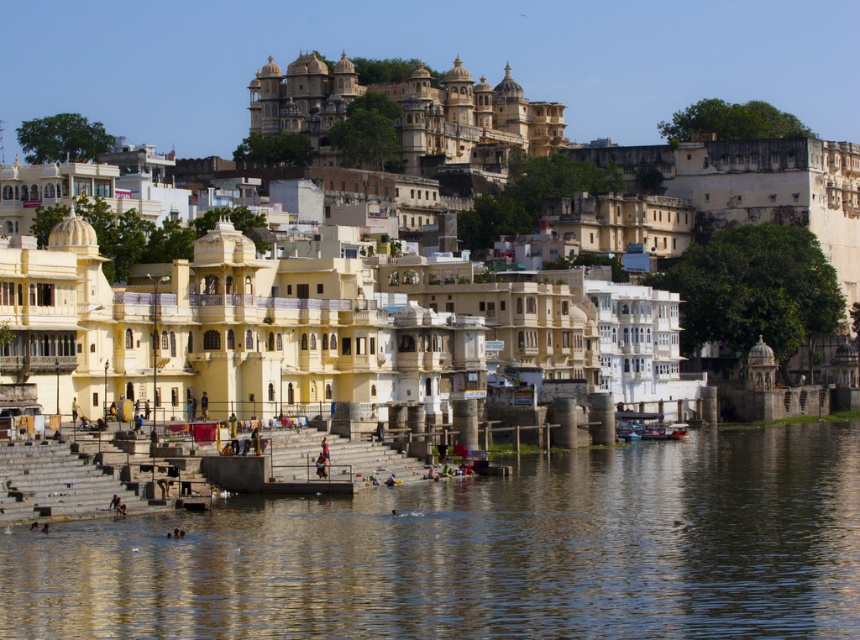
Question: Does brown water at lower center have a larger size compared to matte yellow building at center?

Choices:
 (A) no
 (B) yes

Answer: (A)

Question: Can you confirm if brown water at lower center is positioned above matte yellow building at center?

Choices:
 (A) no
 (B) yes

Answer: (A)

Question: From the image, what is the correct spatial relationship of brown water at lower center in relation to matte yellow building at center?

Choices:
 (A) above
 (B) below

Answer: (B)

Question: Which point is farther from the camera taking this photo?

Choices:
 (A) (562, 282)
 (B) (599, 561)

Answer: (A)